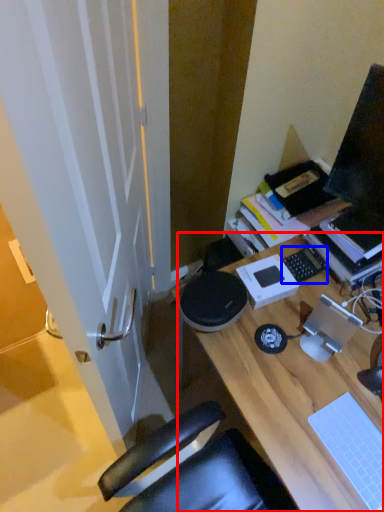
Question: Which object appears closest to the camera in this image, desk (highlighted by a red box) or laptop keyboard (highlighted by a blue box)?

Choices:
 (A) desk
 (B) laptop keyboard

Answer: (A)